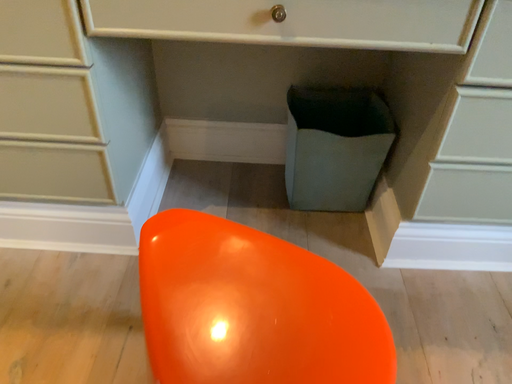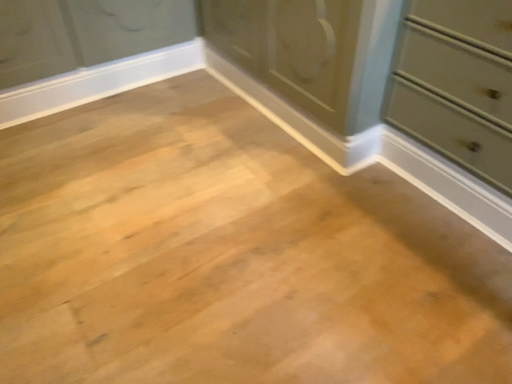
Question: How did the camera likely rotate when shooting the video?

Choices:
 (A) rotated right
 (B) rotated left

Answer: (B)